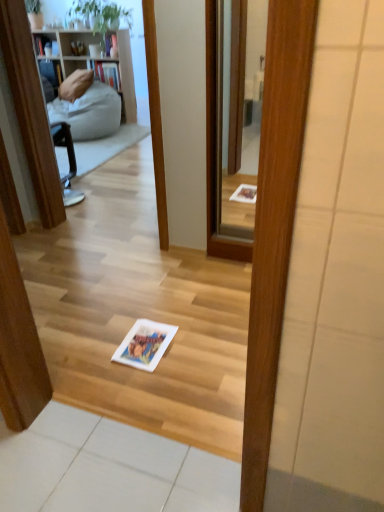
At what (x,y) coordinates should I click in order to perform the action: click on free spot in front of white paper book at center. Please return your answer as a coordinate pair (x, y). This screenshot has width=384, height=512. Looking at the image, I should click on (146, 388).